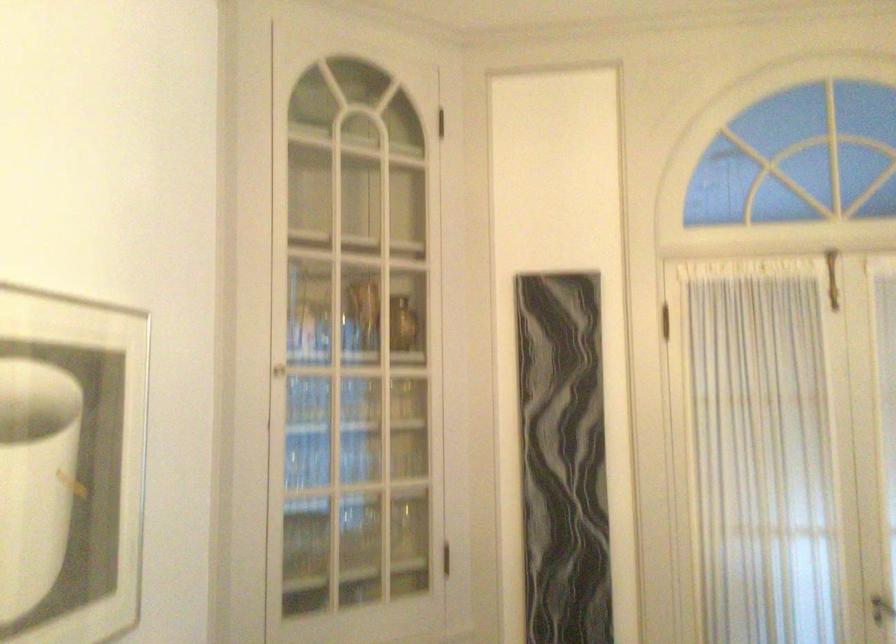
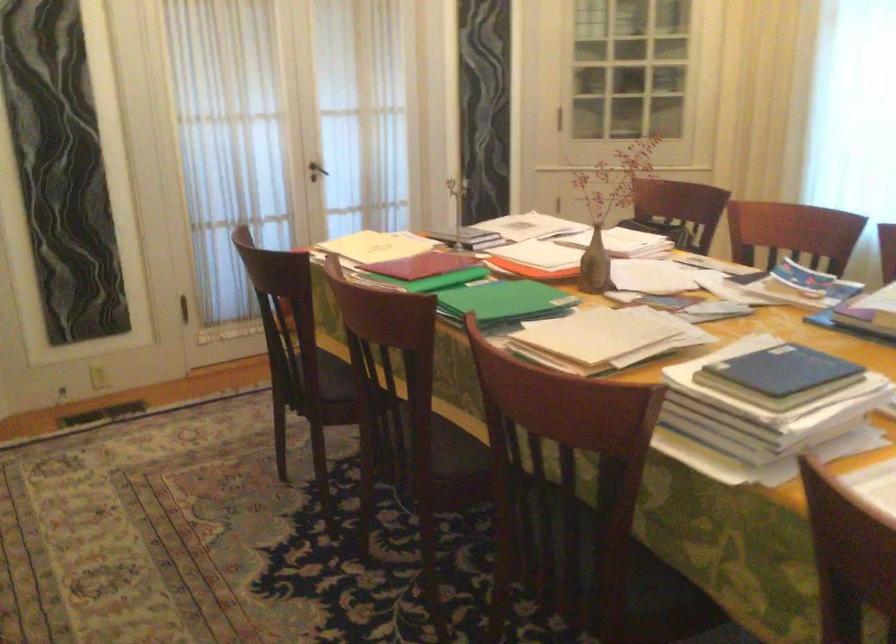
How did the camera likely rotate?

The camera rotated toward right-down.